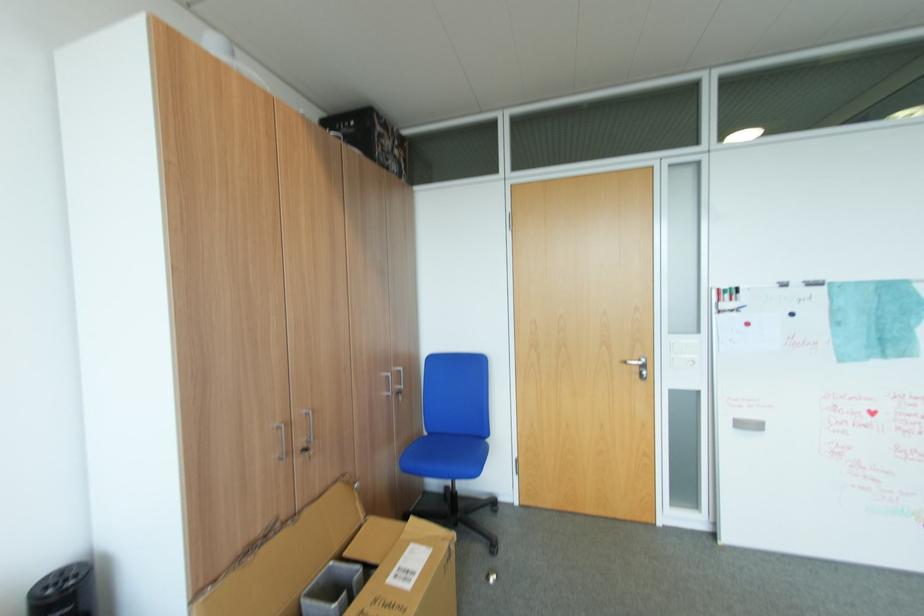
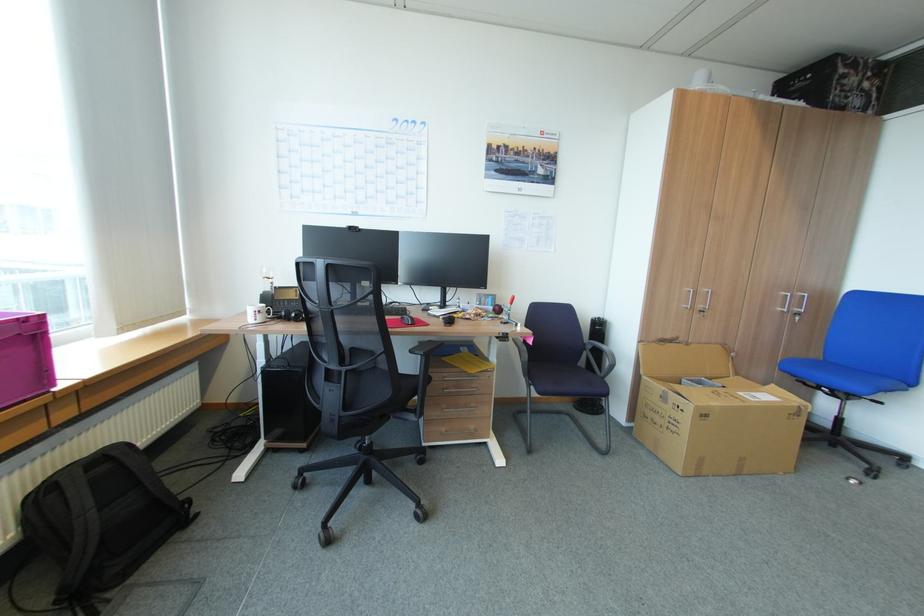
Question: I am providing you with two images of the same scene from different viewpoints. Please identify which objects are invisible in image2.

Choices:
 (A) white mug handle
 (B) dark blue chair armrest
 (C) black chair armrest
 (D) none of these

Answer: (D)